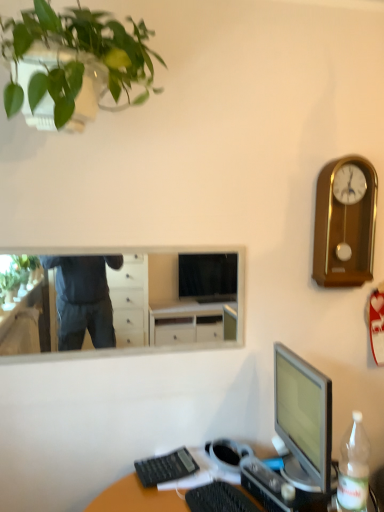
Question: Considering the relative positions of black plastic keyboard at lower center, which is the 1th computer keyboard in left-to-right order, and black plastic keyboard at lower center, positioned as the 1th computer keyboard in front-to-back order, in the image provided, is black plastic keyboard at lower center, which is the 1th computer keyboard in left-to-right order, behind black plastic keyboard at lower center, positioned as the 1th computer keyboard in front-to-back order,?

Choices:
 (A) no
 (B) yes

Answer: (B)

Question: Considering the relative sizes of black plastic keyboard at lower center, which ranks as the first computer keyboard in back-to-front order, and black plastic keyboard at lower center, which is the 1th computer keyboard in right-to-left order, in the image provided, is black plastic keyboard at lower center, which ranks as the first computer keyboard in back-to-front order, shorter than black plastic keyboard at lower center, which is the 1th computer keyboard in right-to-left order,?

Choices:
 (A) yes
 (B) no

Answer: (B)

Question: Can you see black plastic keyboard at lower center, which ranks as the first computer keyboard in back-to-front order, touching black plastic keyboard at lower center, which appears as the second computer keyboard when viewed from the back?

Choices:
 (A) no
 (B) yes

Answer: (A)

Question: Would you say black plastic keyboard at lower center, which ranks as the first computer keyboard in back-to-front order, contains black plastic keyboard at lower center, the second computer keyboard from the left?

Choices:
 (A) no
 (B) yes

Answer: (A)

Question: Is black plastic keyboard at lower center, which ranks as the first computer keyboard in back-to-front order, bigger than black plastic keyboard at lower center, the second computer keyboard from the left?

Choices:
 (A) yes
 (B) no

Answer: (B)

Question: Is point (59, 329) closer or farther from the camera than point (185, 454)?

Choices:
 (A) closer
 (B) farther

Answer: (B)

Question: Considering their positions, is white glossy mirror at upper center located in front of or behind black plastic keyboard at lower center, which is the second computer keyboard from right to left?

Choices:
 (A) behind
 (B) front

Answer: (A)

Question: Do you think white glossy mirror at upper center is within black plastic keyboard at lower center, which ranks as the first computer keyboard in back-to-front order, or outside of it?

Choices:
 (A) outside
 (B) inside

Answer: (A)

Question: Considering the positions of white glossy mirror at upper center and black plastic keyboard at lower center, which is the 2th computer keyboard from front to back, in the image, is white glossy mirror at upper center wider or thinner than black plastic keyboard at lower center, which is the 2th computer keyboard from front to back,?

Choices:
 (A) wide
 (B) thin

Answer: (B)

Question: Looking at their shapes, would you say green matte plant at upper left is wider or thinner than gold polished wood clock at upper right?

Choices:
 (A) wide
 (B) thin

Answer: (A)

Question: From the image's perspective, is green matte plant at upper left located above or below gold polished wood clock at upper right?

Choices:
 (A) above
 (B) below

Answer: (A)

Question: Visually, is green matte plant at upper left positioned to the left or to the right of gold polished wood clock at upper right?

Choices:
 (A) right
 (B) left

Answer: (B)

Question: From a real-world perspective, is green matte plant at upper left physically located above or below gold polished wood clock at upper right?

Choices:
 (A) above
 (B) below

Answer: (A)

Question: From the image's perspective, is gold polished wood clock at upper right located above or below white glossy mirror at upper center?

Choices:
 (A) below
 (B) above

Answer: (B)

Question: From their relative heights in the image, would you say gold polished wood clock at upper right is taller or shorter than white glossy mirror at upper center?

Choices:
 (A) short
 (B) tall

Answer: (B)